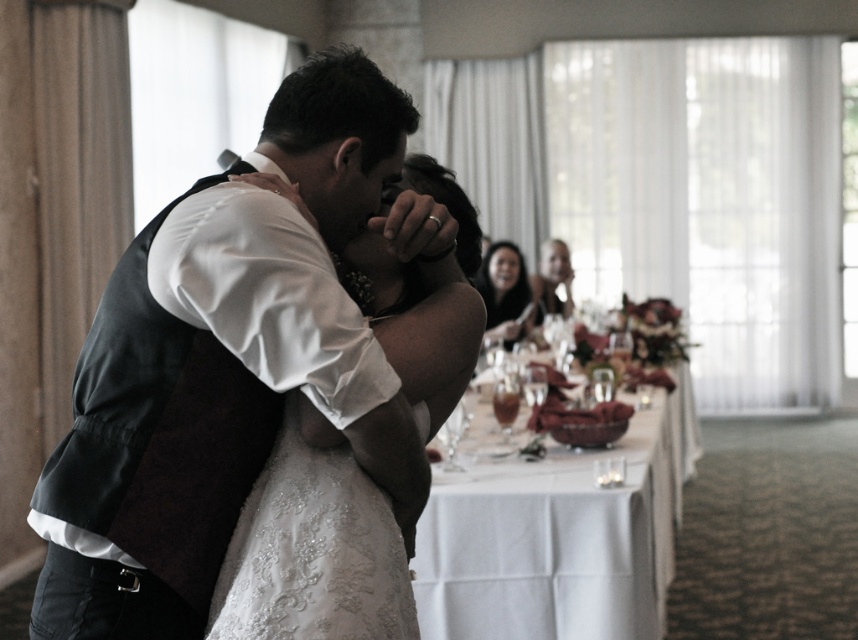
You are a photographer at the wedding reception. You need to capture a closeup shot of the matte black vest at center and the white cloth at center. Which object should you zoom in on first to ensure it fits in the frame without cropping?

The matte black vest at center has a smaller size compared to the white cloth at center, so you should zoom in on the white cloth at center first to ensure it fits in the frame without cropping.

You are a photographer at the wedding reception. You want to capture a photo of the smooth black hair at center without the white cloth at center blocking it. What should you do?

The white cloth at center is in front of the smooth black hair at center, so to avoid blocking the smooth black hair at center, you should move the camera angle slightly backward or adjust the composition to exclude the white cloth at center from the frame.

You are a photographer at the wedding reception. You need to capture a photo where both the matte black vest at center and the smooth black hair at center are visible. Based on their positions, which object should you focus on first to ensure both are in frame?

The matte black vest at center is to the left of smooth black hair at center. To capture both in the frame, focus on the matte black vest at center first as it is positioned to the left, ensuring the smooth black hair at center remains within the right side of the frame.